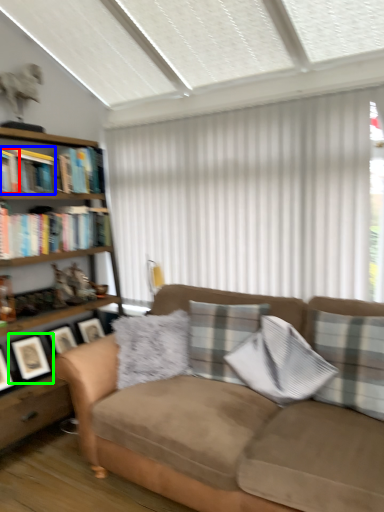
Question: Estimate the real-world distances between objects in this image. Which object is farther from book (highlighted by a red box), book (highlighted by a blue box) or picture frame (highlighted by a green box)?

Choices:
 (A) book
 (B) picture frame

Answer: (B)